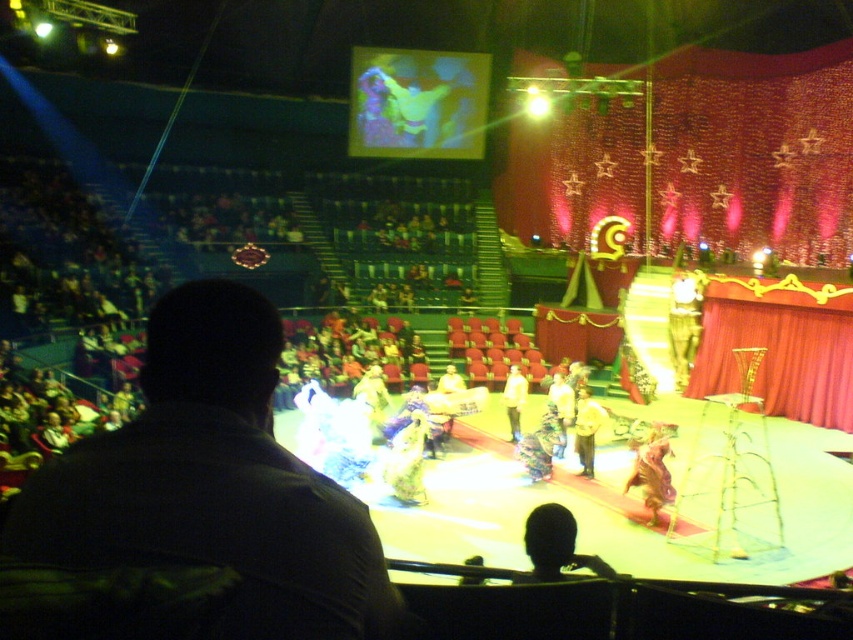
You are a stagehand preparing to adjust the lighting for the next act. You notice the dark brown leather jacket at center and the red velvet curtain at right. Which object is closer to the audience seated in the foreground?

The dark brown leather jacket at center is closer to the audience seated in the foreground because it is in front of the red velvet curtain at right.

You are sitting in the audience of the circus tent and see two points marked on the stage floor. The first point is at coordinate point [343,625] and the second point is at coordinate point [587,435]. Which point is closer to you?

Point [343,625] is in front of point [587,435], so it is closer to you.

You are a stagehand preparing to adjust the lighting for the next act. You notice two items on stage at the center of the scene. Which item is smaller in size between the dark brown leather jacket at center and the yellow fabric pants at center?

The dark brown leather jacket at center is smaller in size compared to the yellow fabric pants at center.